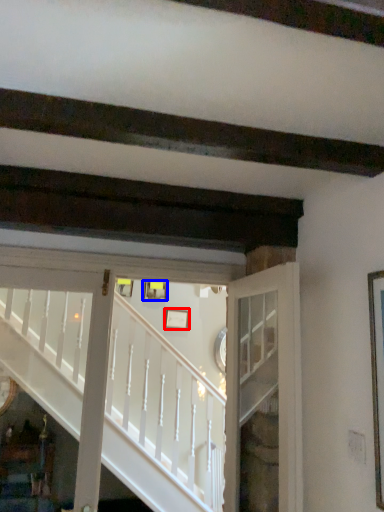
Question: Which object appears closest to the camera in this image, picture frame (highlighted by a red box) or picture frame (highlighted by a blue box)?

Choices:
 (A) picture frame
 (B) picture frame

Answer: (A)